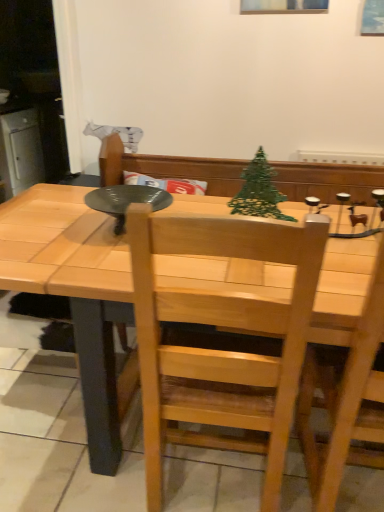
Question: Is the position of natural wood chair at center more distant than that of green wire christmas tree at center?

Choices:
 (A) no
 (B) yes

Answer: (A)

Question: Is natural wood chair at center facing towards green wire christmas tree at center?

Choices:
 (A) yes
 (B) no

Answer: (A)

Question: Is natural wood chair at center wider than green wire christmas tree at center?

Choices:
 (A) yes
 (B) no

Answer: (A)

Question: Can you see natural wood chair at center touching green wire christmas tree at center?

Choices:
 (A) no
 (B) yes

Answer: (A)

Question: Is natural wood chair at center surrounding green wire christmas tree at center?

Choices:
 (A) yes
 (B) no

Answer: (B)

Question: Is natural wood chair at center to the right of green wire christmas tree at center from the viewer's perspective?

Choices:
 (A) yes
 (B) no

Answer: (B)

Question: Does green wire christmas tree at center have a smaller size compared to natural wood chair at center?

Choices:
 (A) no
 (B) yes

Answer: (B)

Question: Is the surface of green wire christmas tree at center in direct contact with natural wood chair at center?

Choices:
 (A) no
 (B) yes

Answer: (A)

Question: Is green wire christmas tree at center far away from natural wood chair at center?

Choices:
 (A) yes
 (B) no

Answer: (B)

Question: Is natural wood chair at center completely or partially inside green wire christmas tree at center?

Choices:
 (A) yes
 (B) no

Answer: (B)

Question: Is the position of green wire christmas tree at center more distant than that of natural wood chair at center?

Choices:
 (A) yes
 (B) no

Answer: (A)

Question: Can you confirm if green wire christmas tree at center is taller than natural wood chair at center?

Choices:
 (A) no
 (B) yes

Answer: (A)

Question: From the image's perspective, would you say green wire christmas tree at center is positioned over natural wood table at center?

Choices:
 (A) no
 (B) yes

Answer: (B)